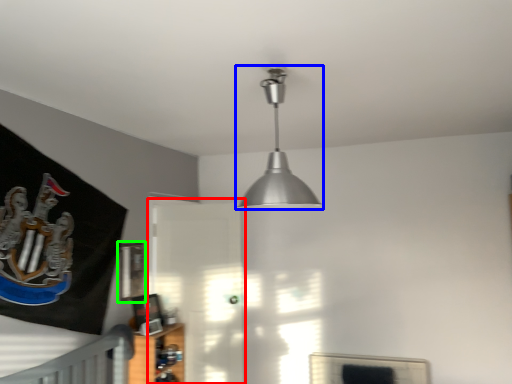
Question: Which object is positioned closest to glass door (highlighted by a red box)? Select from lamp (highlighted by a blue box) and picture frame (highlighted by a green box).

Choices:
 (A) lamp
 (B) picture frame

Answer: (B)